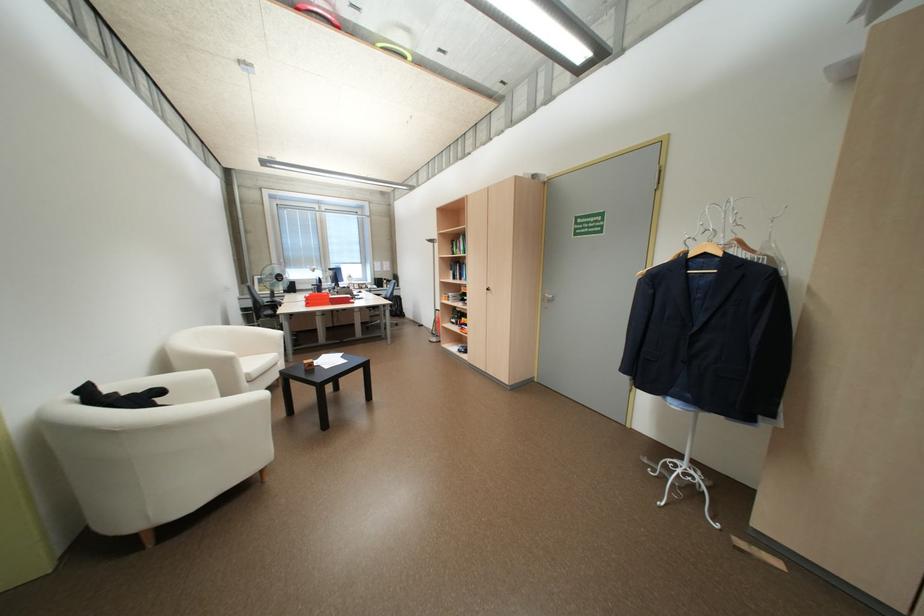
The location [703,236] corresponds to which object?

It corresponds to the wooden hanger in the image.